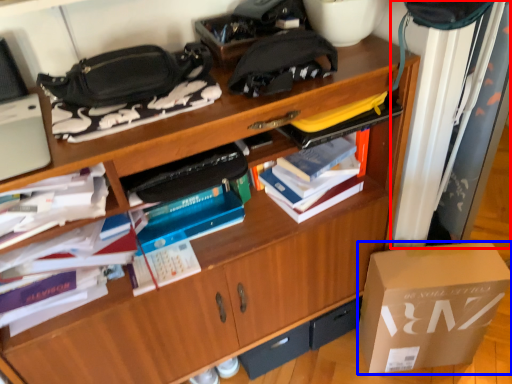
Question: Which object appears farthest to the camera in this image, curtain (highlighted by a red box) or box (highlighted by a blue box)?

Choices:
 (A) curtain
 (B) box

Answer: (B)